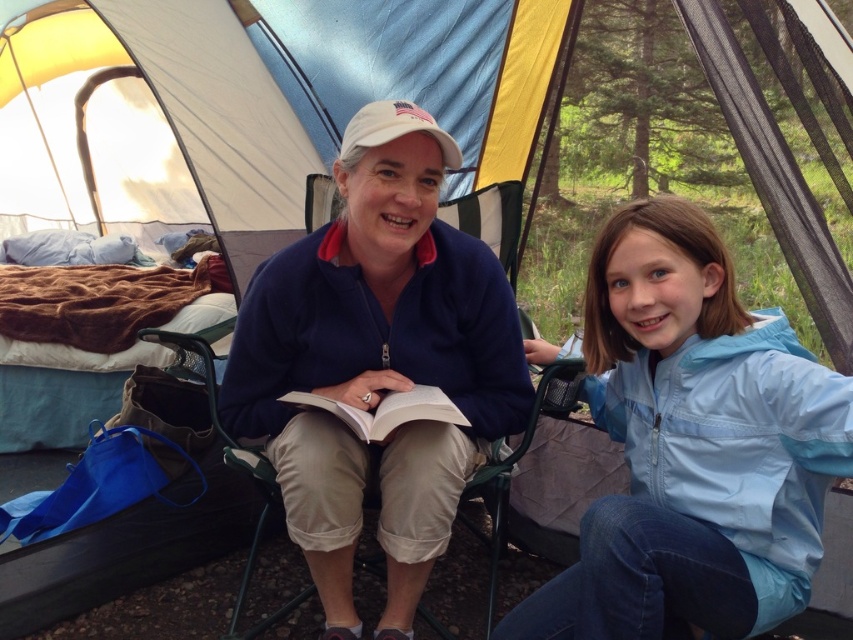
Question: Which object appears closest to the camera in this image?

Choices:
 (A) navy fleece jacket at center
 (B) white paper book at center
 (C) light blue nylon jacket at lower right

Answer: (C)

Question: Which object is the farthest from the white paper book at center?

Choices:
 (A) navy fleece jacket at center
 (B) light blue nylon jacket at lower right

Answer: (B)

Question: Does light blue nylon jacket at lower right appear under white paper book at center?

Choices:
 (A) yes
 (B) no

Answer: (A)

Question: Is navy fleece jacket at center thinner than white paper book at center?

Choices:
 (A) no
 (B) yes

Answer: (A)

Question: Which point is farther from the camera taking this photo?

Choices:
 (A) (350, 420)
 (B) (363, 243)

Answer: (B)

Question: Does navy fleece jacket at center have a greater width compared to white paper book at center?

Choices:
 (A) yes
 (B) no

Answer: (A)